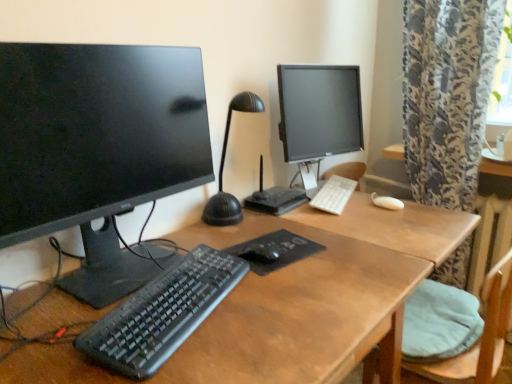
Identify the location of vacant space to the right of black textured mousepad at center. This screenshot has width=512, height=384. (342, 247).